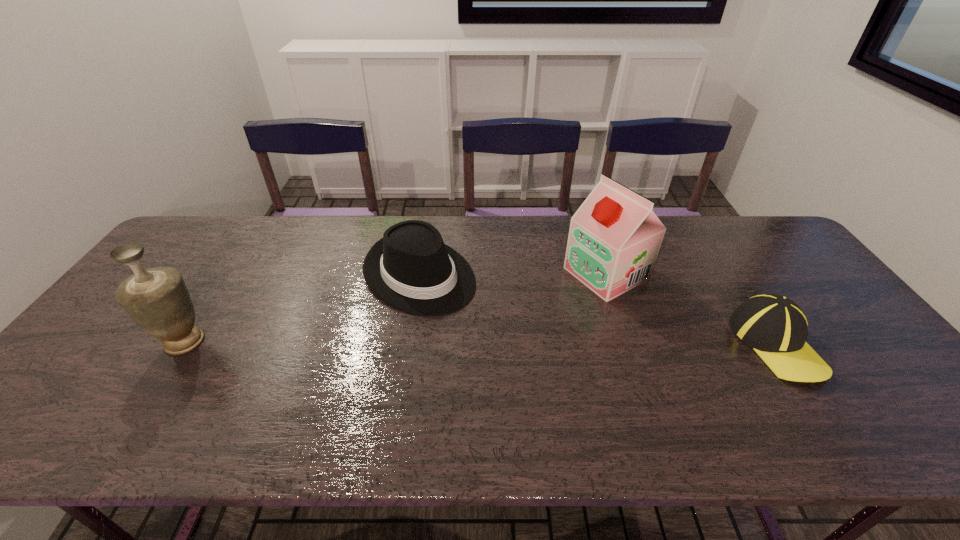
Identify the location of the leftmost object. (157, 299).

I want to click on the rightmost object, so click(774, 326).

Where is `baseball cap`? baseball cap is located at coordinates (774, 326).

This screenshot has width=960, height=540. In order to click on soya milk in this screenshot , I will do `click(614, 239)`.

You are a GUI agent. You are given a task and a screenshot of the screen. Output one action in this format:
    pyautogui.click(x=<x>, y=<y>)
    Task: Click on the third tallest object
    Image resolution: width=960 pixels, height=540 pixels.
    Given the screenshot: What is the action you would take?
    pyautogui.click(x=411, y=269)

Where is `the third object from right to left`? the third object from right to left is located at coordinates (411, 269).

In order to click on free space located on the right of the urn in this screenshot , I will do `click(246, 342)`.

Locate an element on the screen. free space located with the brim of the rightmost object facing forward is located at coordinates (816, 406).

You are a GUI agent. You are given a task and a screenshot of the screen. Output one action in this format:
    pyautogui.click(x=<x>, y=<y>)
    Task: Click on the vacant space located 0.090m with the cap open on the soya milk
    This screenshot has width=960, height=540.
    Given the screenshot: What is the action you would take?
    [x=551, y=300]

The image size is (960, 540). In order to click on vacant region located with the cap open on the soya milk in this screenshot , I will do `click(493, 329)`.